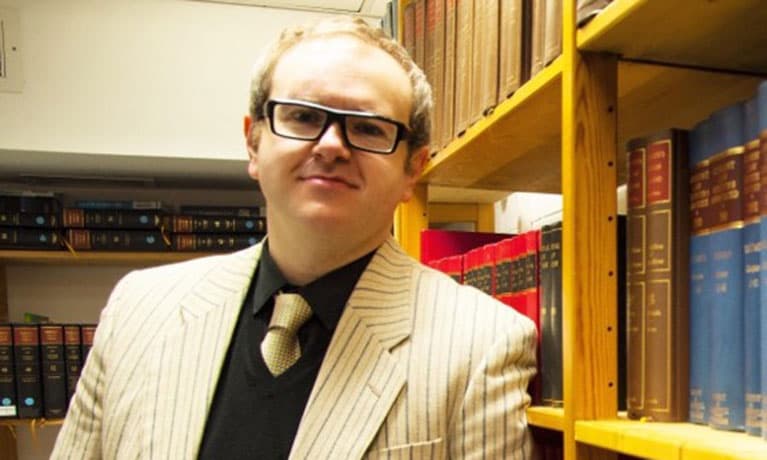
Locate an element on the screen. book is located at coordinates (716, 231).